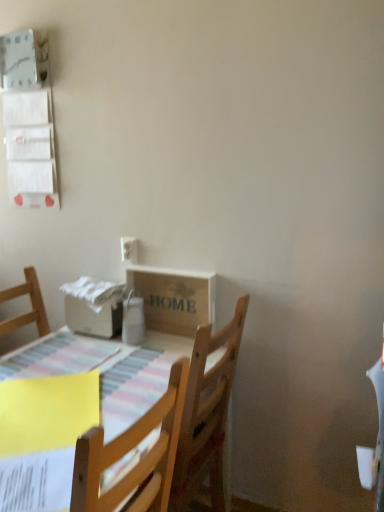
Question: Would you say wooden table at lower left is part of wooden crate at center's contents?

Choices:
 (A) no
 (B) yes

Answer: (A)

Question: Can you confirm if wooden crate at center is smaller than wooden table at lower left?

Choices:
 (A) no
 (B) yes

Answer: (B)

Question: Considering the relative sizes of wooden crate at center and wooden table at lower left in the image provided, is wooden crate at center bigger than wooden table at lower left?

Choices:
 (A) no
 (B) yes

Answer: (A)

Question: From a real-world perspective, is wooden crate at center positioned under wooden table at lower left based on gravity?

Choices:
 (A) yes
 (B) no

Answer: (B)

Question: Would you say wooden crate at center is a long distance from wooden table at lower left?

Choices:
 (A) yes
 (B) no

Answer: (B)

Question: Is wooden crate at center next to wooden table at lower left?

Choices:
 (A) no
 (B) yes

Answer: (A)

Question: Can you confirm if white plastic electric outlet at upper left is taller than wooden crate at center?

Choices:
 (A) no
 (B) yes

Answer: (A)

Question: Does white plastic electric outlet at upper left come in front of wooden crate at center?

Choices:
 (A) yes
 (B) no

Answer: (B)

Question: Is white plastic electric outlet at upper left thinner than wooden crate at center?

Choices:
 (A) no
 (B) yes

Answer: (B)

Question: Is there a large distance between white plastic electric outlet at upper left and wooden crate at center?

Choices:
 (A) yes
 (B) no

Answer: (B)

Question: Does white plastic electric outlet at upper left have a greater width compared to wooden crate at center?

Choices:
 (A) yes
 (B) no

Answer: (B)

Question: Does white plastic electric outlet at upper left have a larger size compared to wooden crate at center?

Choices:
 (A) yes
 (B) no

Answer: (B)

Question: Is white plastic electric outlet at upper left shorter than wooden table at lower left?

Choices:
 (A) yes
 (B) no

Answer: (A)